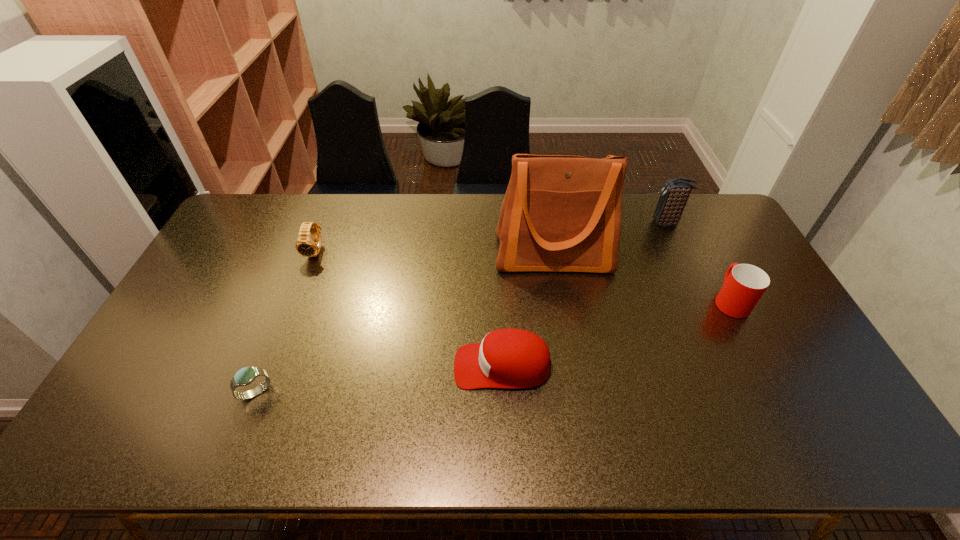
Where is `the tallest object`? the tallest object is located at coordinates (560, 213).

You are a GUI agent. You are given a task and a screenshot of the screen. Output one action in this format:
    pyautogui.click(x=<x>, y=<y>)
    Task: Click on the clutch bag
    Image resolution: width=960 pixels, height=540 pixels.
    Given the screenshot: What is the action you would take?
    pyautogui.click(x=674, y=195)

Image resolution: width=960 pixels, height=540 pixels. Find the location of `the fifth shortest object`. the fifth shortest object is located at coordinates (674, 195).

This screenshot has height=540, width=960. In order to click on the fourth farthest object in this screenshot , I will do `click(744, 284)`.

Image resolution: width=960 pixels, height=540 pixels. Find the location of `the farther watch`. the farther watch is located at coordinates (307, 247).

The image size is (960, 540). In order to click on baseball cap in this screenshot , I will do `click(510, 358)`.

You are a GUI agent. You are given a task and a screenshot of the screen. Output one action in this format:
    pyautogui.click(x=<x>, y=<y>)
    Task: Click on the nearer watch
    The width and height of the screenshot is (960, 540).
    Given the screenshot: What is the action you would take?
    pyautogui.click(x=246, y=375)

What are the coordinates of `the shorter watch` in the screenshot? It's located at (246, 375).

Image resolution: width=960 pixels, height=540 pixels. I want to click on vacant space located 0.320m on the right of the shopping bag, so click(708, 255).

I want to click on vacant space located with the zip open on the farthest object, so click(x=601, y=224).